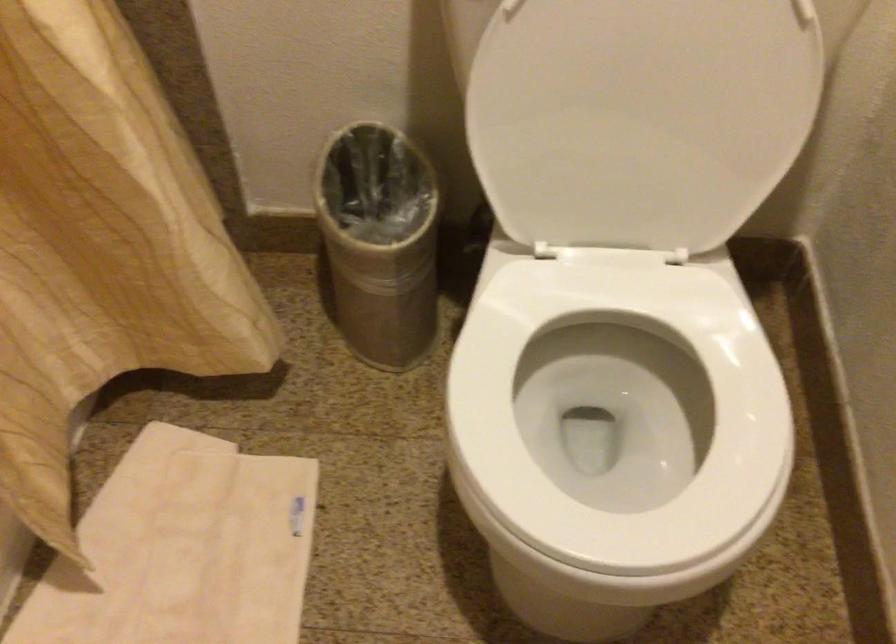
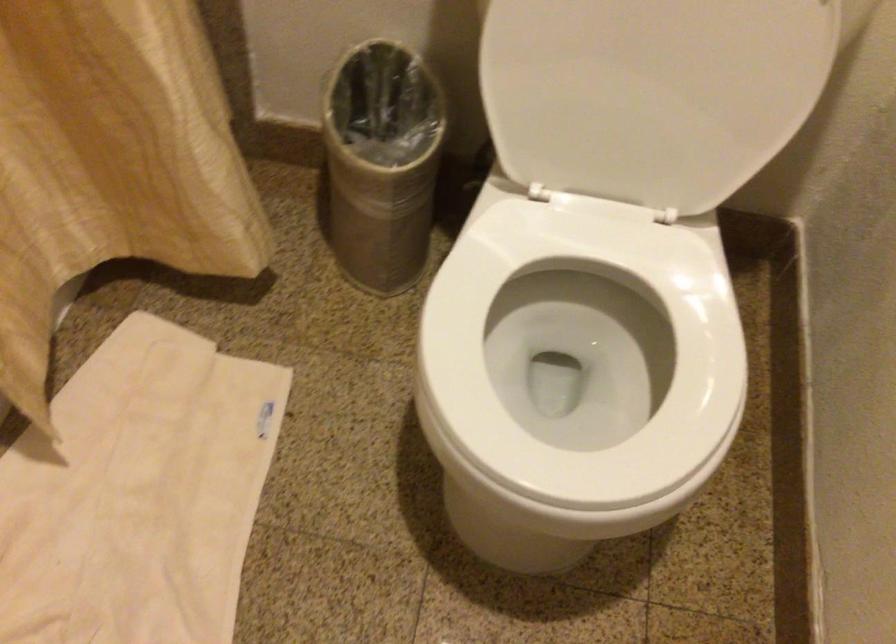
Question: How did the camera likely rotate?

Choices:
 (A) Left
 (B) Right
 (C) Up
 (D) Down

Answer: (D)